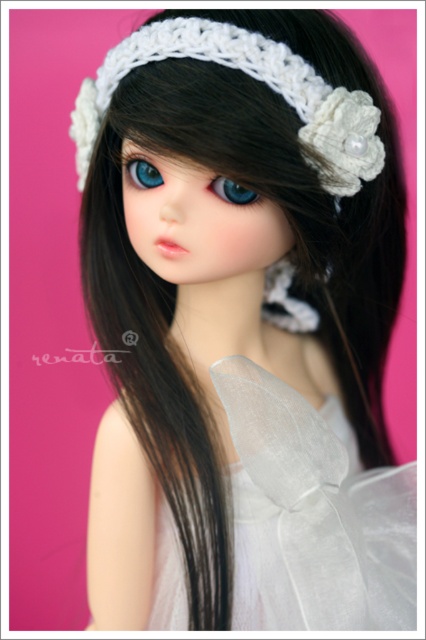
You are an artist trying to paint this doll. You notice the white crochet headband at upper center and the blue glossy eye at upper center. Which object is closer to you when looking at the doll?

The white crochet headband at upper center is closer to you because it is in front of the blue glossy eye at upper center.

You are a photographer adjusting the focus on your camera. You need to focus on both the point at point (362, 541) and the point at point (287, 76). Which point should you focus on first to ensure the closest object is sharp?

You should focus on point (362, 541) first because it is closer to the viewer than point (287, 76), ensuring the closest object is in sharp focus.

Where is the translucent white fabric at center located in the image?

The translucent white fabric at center is located at point [311,515].